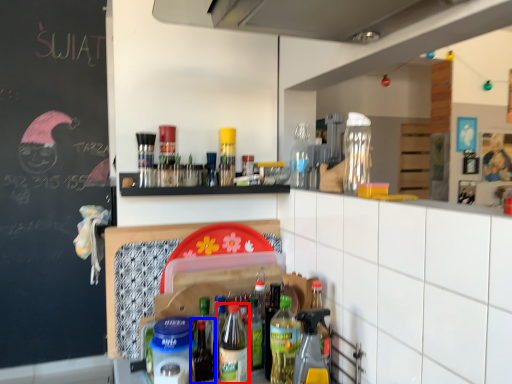
Question: Which object appears farthest to the camera in this image, bottle (highlighted by a red box) or bottle (highlighted by a blue box)?

Choices:
 (A) bottle
 (B) bottle

Answer: (B)